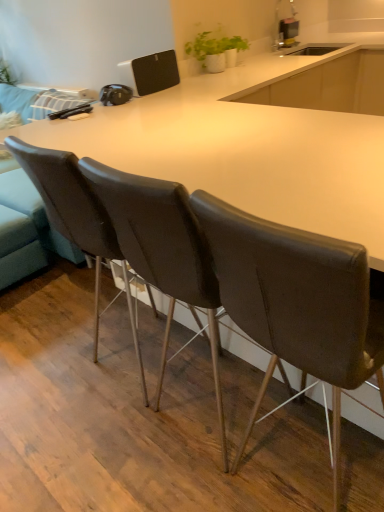
The image size is (384, 512). Identify the location of free location in front of leather at left, which appears as the 1th chair when viewed from the left. (120, 455).